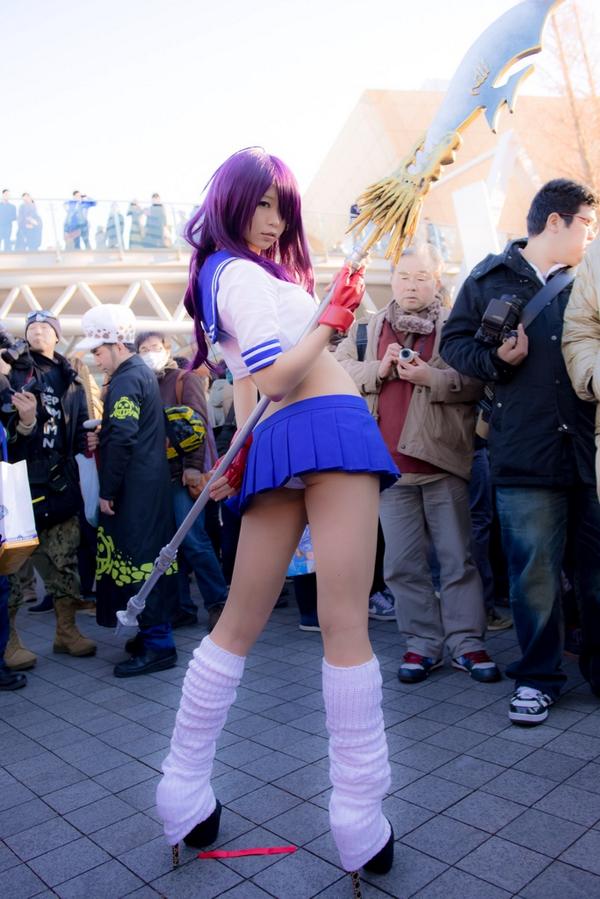
This screenshot has height=899, width=600. I want to click on grey tile, so click(474, 762).